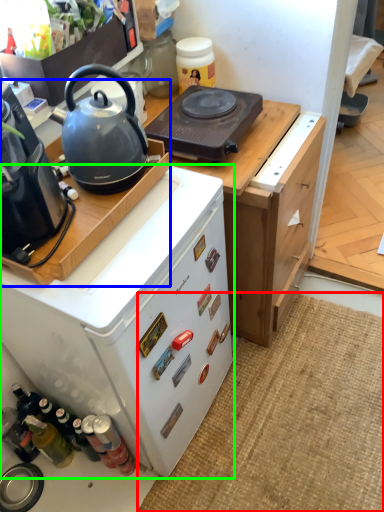
Question: Which object is the closest to the doormat (highlighted by a red box)? Choose among these: kitchen appliance (highlighted by a blue box) or home appliance (highlighted by a green box).

Choices:
 (A) kitchen appliance
 (B) home appliance

Answer: (B)